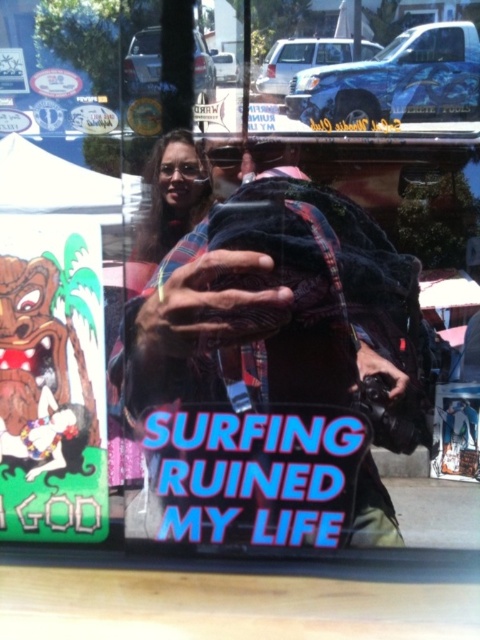
Question: Is green paper sign at lower left to the left of white paper poster at center from the viewer's perspective?

Choices:
 (A) no
 (B) yes

Answer: (B)

Question: Does velvet black jacket at center lie behind green paper sign at lower left?

Choices:
 (A) no
 (B) yes

Answer: (B)

Question: Considering the real-world distances, which object is closest to the velvet black jacket at center?

Choices:
 (A) green paper sign at lower left
 (B) plaid fabric at center
 (C) white paper poster at center

Answer: (B)

Question: From the image, what is the correct spatial relationship of velvet black jacket at center in relation to white paper poster at center?

Choices:
 (A) above
 (B) below

Answer: (A)

Question: Which point is farther from the camera taking this photo?

Choices:
 (A) (164, 170)
 (B) (132, 388)
 (C) (98, 456)

Answer: (B)

Question: Which object appears farthest from the camera in this image?

Choices:
 (A) plaid fabric at center
 (B) velvet black jacket at center

Answer: (B)